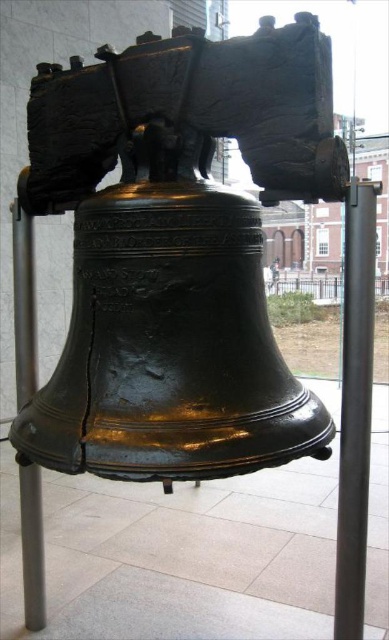
Question: Which point is farther from the camera taking this photo?

Choices:
 (A) (19, 369)
 (B) (376, 189)

Answer: (A)

Question: Is black metal pole at right smaller than black metal pole at lower left?

Choices:
 (A) no
 (B) yes

Answer: (A)

Question: Is black metal pole at right thinner than black metal pole at lower left?

Choices:
 (A) no
 (B) yes

Answer: (A)

Question: Which object is closer to the camera taking this photo?

Choices:
 (A) black metal pole at right
 (B) black metal pole at lower left

Answer: (A)

Question: Does black metal pole at right have a lesser width compared to black metal pole at lower left?

Choices:
 (A) no
 (B) yes

Answer: (A)